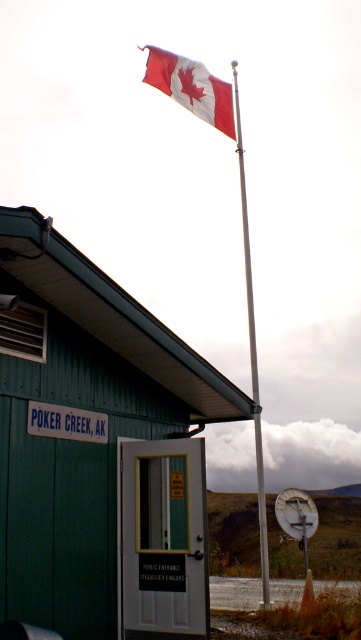
Question: Which is farther from the green wood cabin at center?

Choices:
 (A) red and white fabric flag at upper center
 (B) silver metallic flag pole at center

Answer: (A)

Question: Which point appears closest to the camera in this image?

Choices:
 (A) (111, 460)
 (B) (163, 88)

Answer: (A)

Question: Is red and white fabric flag at upper center further to camera compared to silver metallic flag pole at center?

Choices:
 (A) yes
 (B) no

Answer: (A)

Question: Which point is closer to the camera?

Choices:
 (A) (264, 609)
 (B) (84, 518)
 (C) (176, 77)

Answer: (B)

Question: In this image, where is green wood cabin at center located relative to silver metallic flag pole at center?

Choices:
 (A) above
 (B) below

Answer: (B)

Question: Does green wood cabin at center appear under red and white fabric flag at upper center?

Choices:
 (A) no
 (B) yes

Answer: (B)